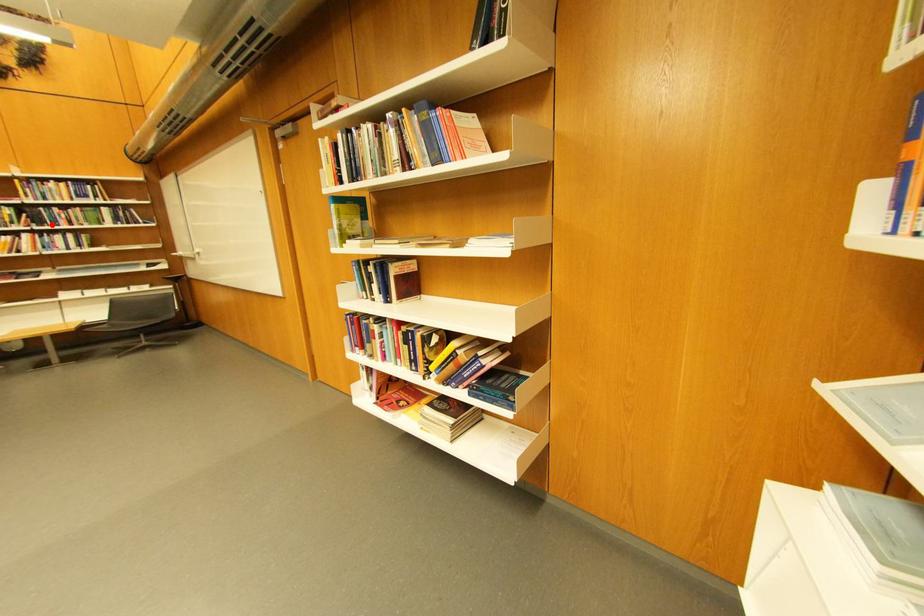
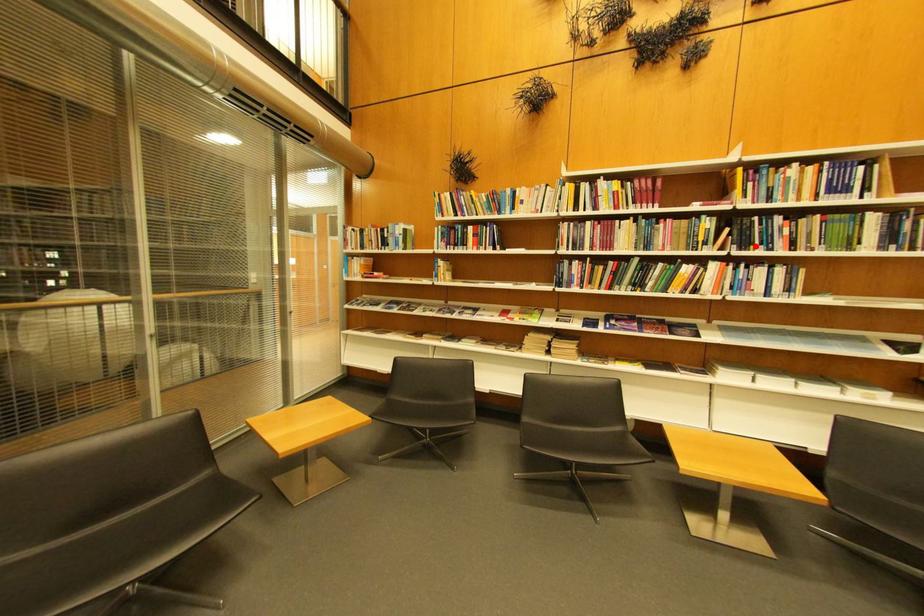
I am providing you with two images of the same scene from different viewpoints. A red point is marked on the first image and another point is marked on the second image. Does the point marked in image1 correspond to the same location as the one in image2?

Yes